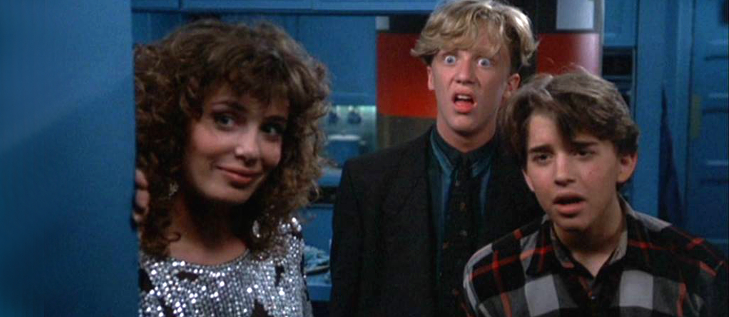
Identify the location of refrigerator. This screenshot has height=317, width=729. 404,129.